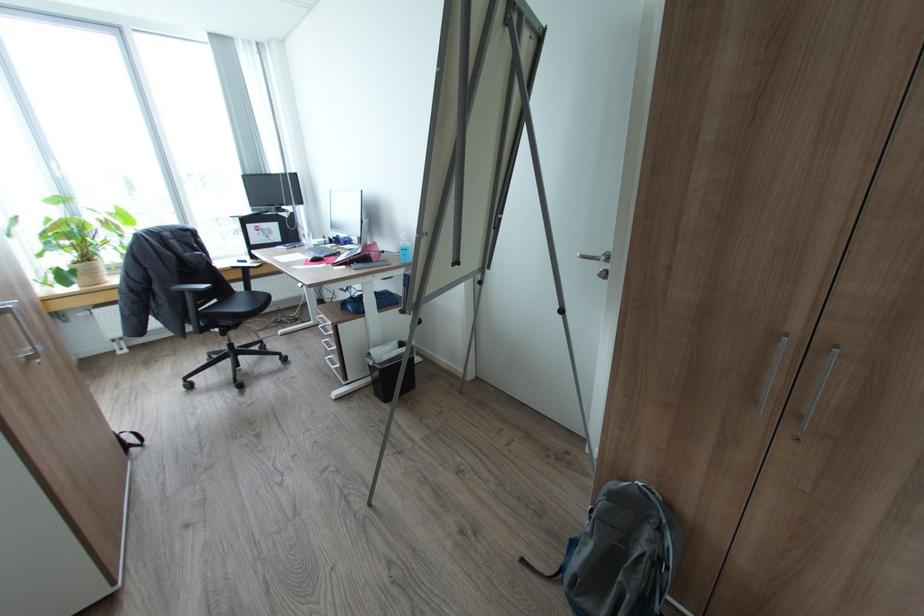
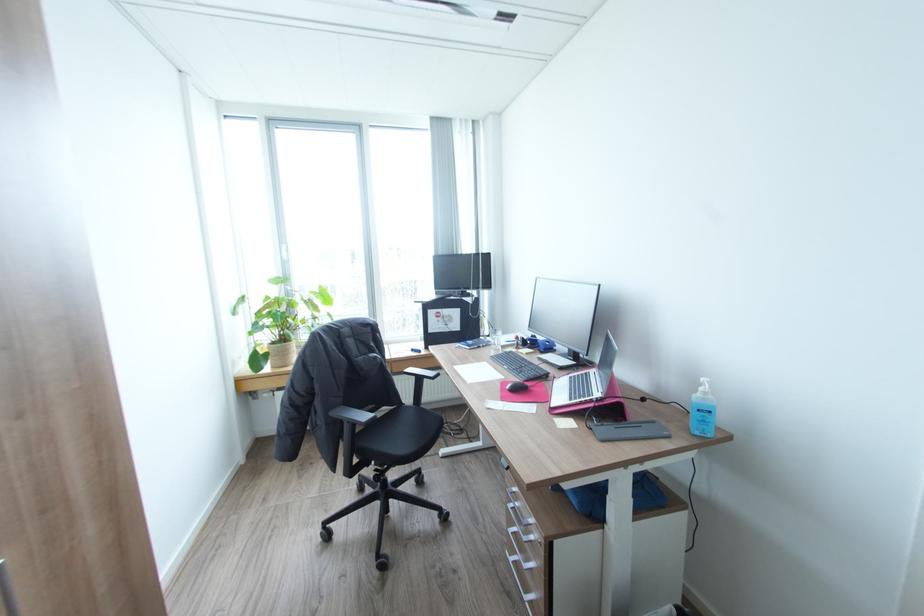
In the second image, find the point that corresponds to point (408, 240) in the first image.

(710, 392)